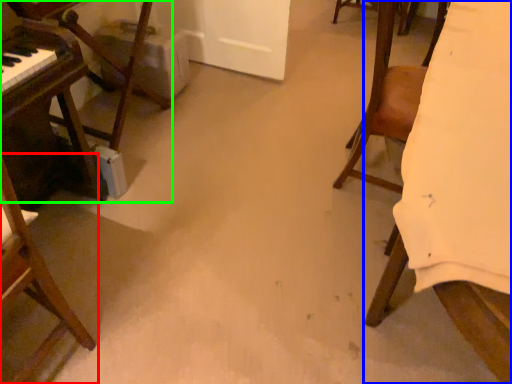
Question: Considering the real-world distances, which object is farthest from chair (highlighted by a red box)? furniture (highlighted by a blue box) or furniture (highlighted by a green box)?

Choices:
 (A) furniture
 (B) furniture

Answer: (A)